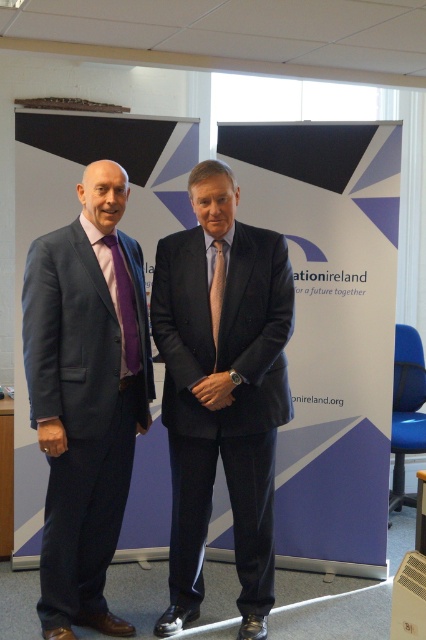
Who is more distant from viewer, (172,298) or (42,257)?

Point (172,298)

Where is `matte black suit at center`? The height and width of the screenshot is (640, 426). matte black suit at center is located at coordinates (221, 392).

You are a GUI agent. You are given a task and a screenshot of the screen. Output one action in this format:
    pyautogui.click(x=<x>, y=<y>)
    Task: Click on the matte black suit at center
    
    Given the screenshot: What is the action you would take?
    pyautogui.click(x=221, y=392)

Is matte black suit at center bigger than silky brown tie at center?

Yes.

Is matte black suit at center wider than silky brown tie at center?

Correct, the width of matte black suit at center exceeds that of silky brown tie at center.

This screenshot has width=426, height=640. Identify the location of matte black suit at center. (221, 392).

Is point (75, 417) more distant than point (135, 369)?

No, (75, 417) is closer to viewer.

Image resolution: width=426 pixels, height=640 pixels. What do you see at coordinates (86, 394) in the screenshot?
I see `matte blue suit at left` at bounding box center [86, 394].

Locate an element on the screen. This screenshot has height=640, width=426. matte blue suit at left is located at coordinates 86,394.